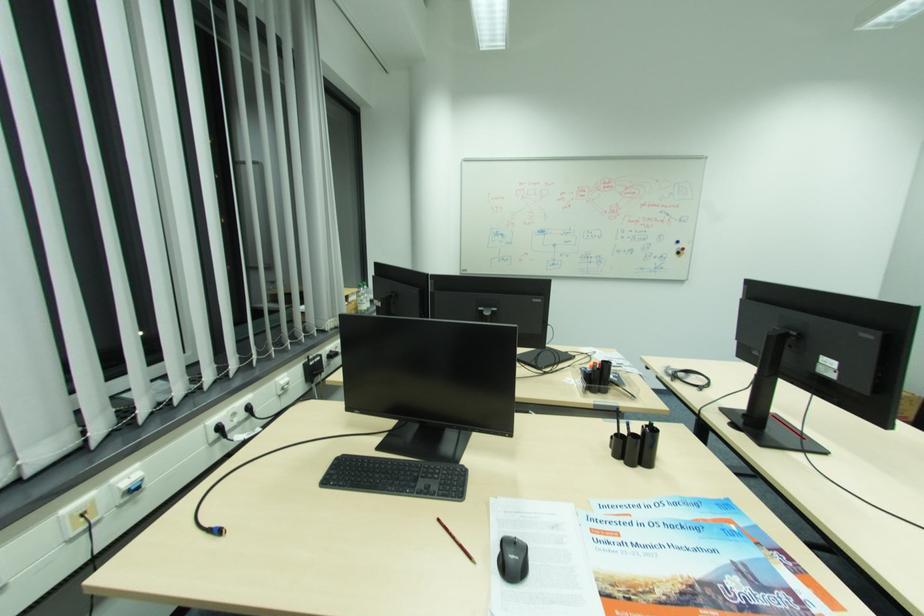
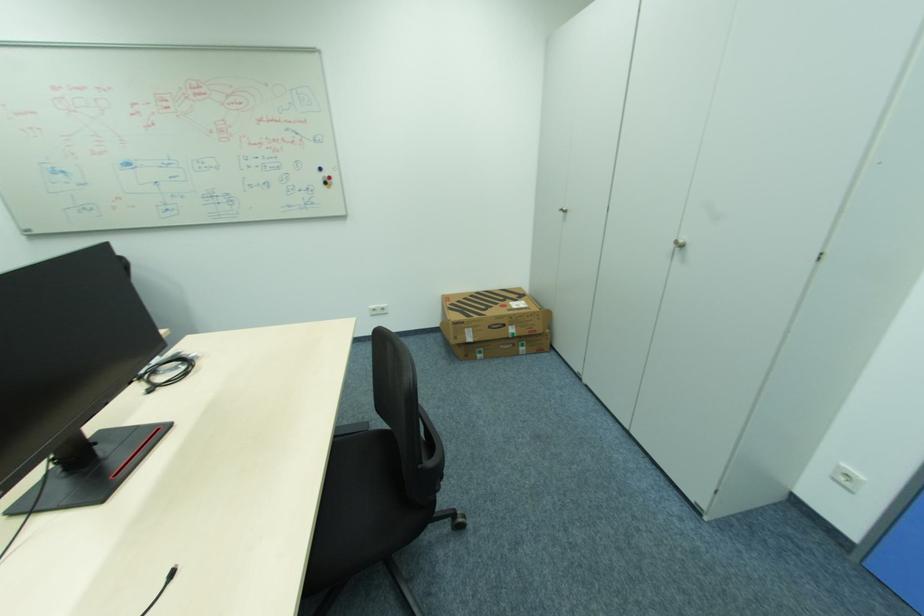
Where in the second image is the point corresponding to the point at 684,253 from the first image?

(331, 184)